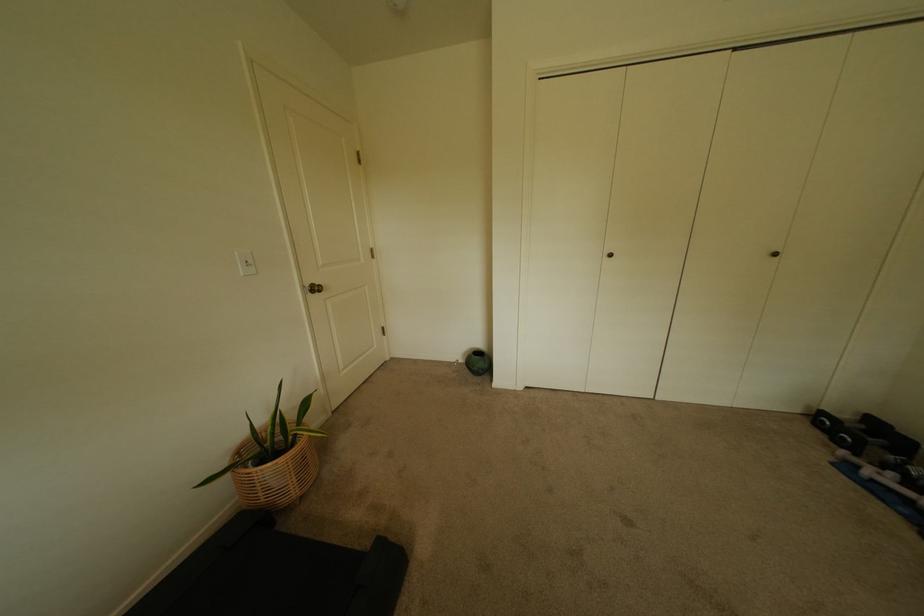
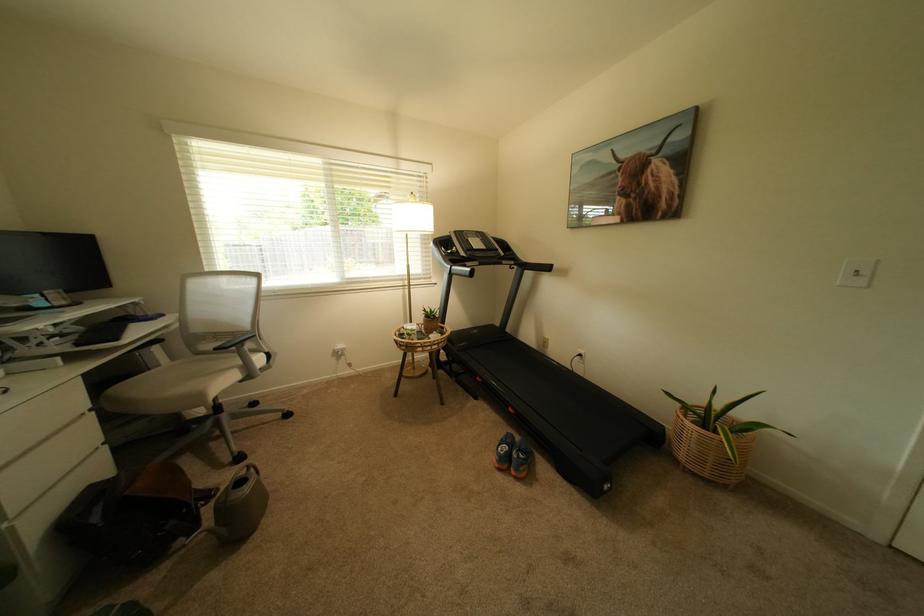
Find the pixel in the second image that matches (254,262) in the first image.

(866, 272)